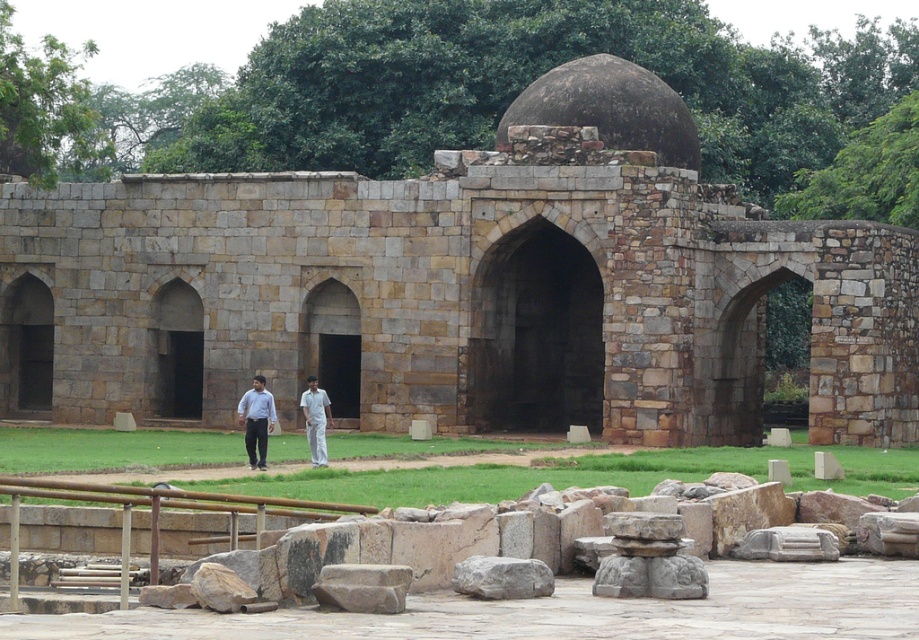
You are an archaeologist examining the ancient stone structure. You notice the brown stone archway at center and the white cotton shirt at center. Which object is bigger in size?

The brown stone archway at center is larger in size compared to the white cotton shirt at center.

You are an archaeologist examining the ancient stone structure. You notice the brown stone archway at center and the gray rough stone at center. Which object is located above the other?

The brown stone archway at center is positioned over the gray rough stone at center.

You are an archaeologist standing at the entrance of the ancient stone structure. You notice a brown stone archway at center and a gray rough stone at center. Which object is closer to you?

The brown stone archway at center is 44.76 meters away from the gray rough stone at center, so the gray rough stone at center is closer to you since it is only 44.76 meters behind the archway.